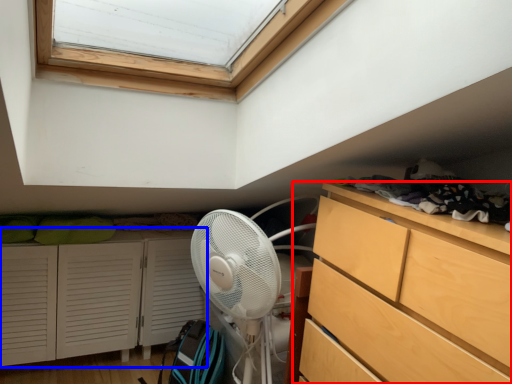
Question: Among these objects, which one is nearest to the camera, chest of drawers (highlighted by a red box) or cupboard (highlighted by a blue box)?

Choices:
 (A) chest of drawers
 (B) cupboard

Answer: (A)